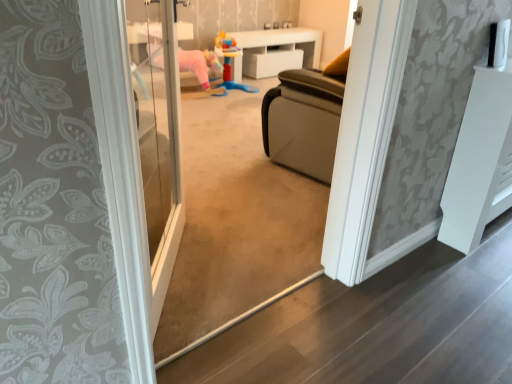
Question: From the image's perspective, relative to white glossy cabinet at upper center, which is the 1th furniture in left-to-right order, is white matte radiator at right, which appears as the 2th furniture when viewed from the back, above or below?

Choices:
 (A) above
 (B) below

Answer: (B)

Question: From a real-world perspective, is white matte radiator at right, the first furniture ordered from the bottom, positioned above or below white glossy cabinet at upper center, the second furniture in the right-to-left sequence?

Choices:
 (A) below
 (B) above

Answer: (B)

Question: Which is farther from the plastic colorful toy at center?

Choices:
 (A) white matte radiator at right, the first furniture in the right-to-left sequence
 (B) white glossy cabinet at upper center, the second furniture positioned from the front

Answer: (A)

Question: Which object is positioned closest to the white glossy cabinet at upper center, the second furniture in the right-to-left sequence?

Choices:
 (A) white matte radiator at right, which ranks as the first furniture in front-to-back order
 (B) plastic colorful toy at center

Answer: (B)